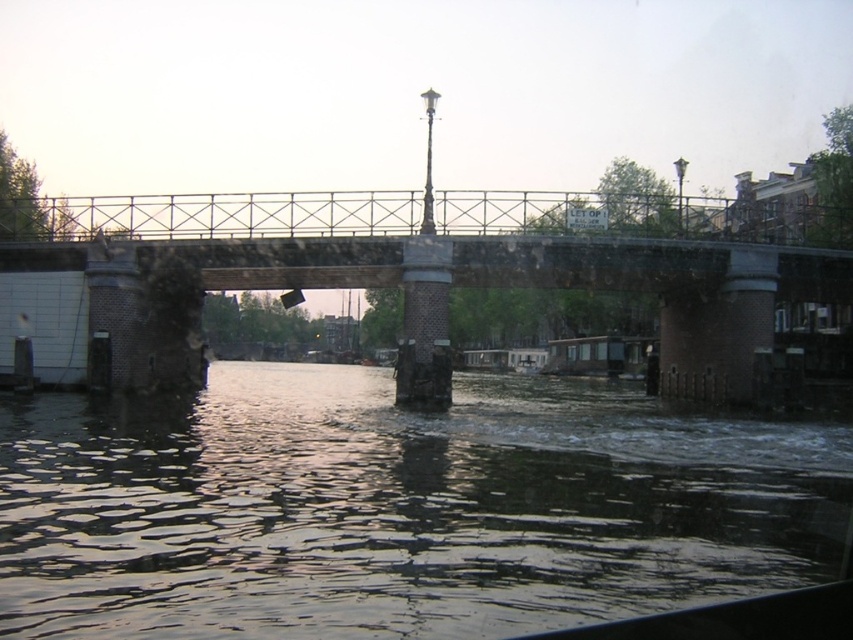
Question: Is dark reflective water at center wider than rusty metal bridge at center?

Choices:
 (A) no
 (B) yes

Answer: (A)

Question: Does dark reflective water at center appear under rusty metal bridge at center?

Choices:
 (A) no
 (B) yes

Answer: (B)

Question: Can you confirm if dark reflective water at center is bigger than rusty metal bridge at center?

Choices:
 (A) yes
 (B) no

Answer: (B)